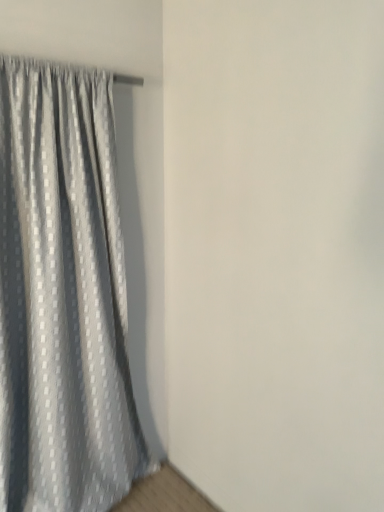
Measure the distance between gray textured curtain at left and camera.

gray textured curtain at left is 5.28 feet away from camera.

Image resolution: width=384 pixels, height=512 pixels. Describe the element at coordinates (62, 296) in the screenshot. I see `gray textured curtain at left` at that location.

You are a GUI agent. You are given a task and a screenshot of the screen. Output one action in this format:
    pyautogui.click(x=<x>, y=<y>)
    Task: Click on the gray textured curtain at left
    The image size is (384, 512).
    Given the screenshot: What is the action you would take?
    pyautogui.click(x=62, y=296)

Image resolution: width=384 pixels, height=512 pixels. I want to click on gray textured curtain at left, so click(62, 296).